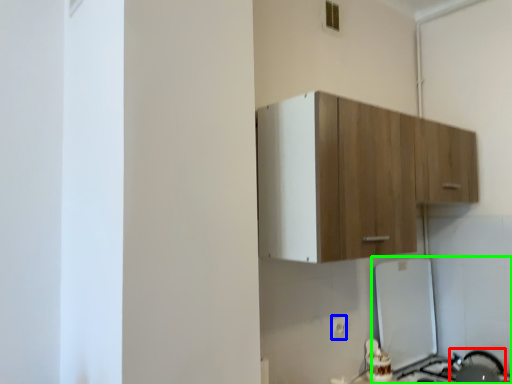
Question: Estimate the real-world distances between objects in this image. Which object is closer to appliance (highlighted by a red box), electric outlet (highlighted by a blue box) or appliance (highlighted by a green box)?

Choices:
 (A) electric outlet
 (B) appliance

Answer: (B)